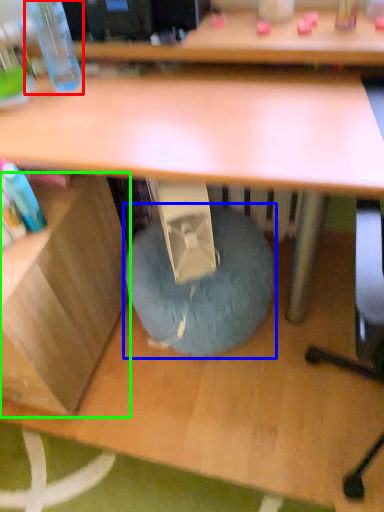
Question: Which object is the closest to the bottle (highlighted by a red box)? Choose among these: bean bag chair (highlighted by a blue box) or shelf (highlighted by a green box).

Choices:
 (A) bean bag chair
 (B) shelf

Answer: (B)